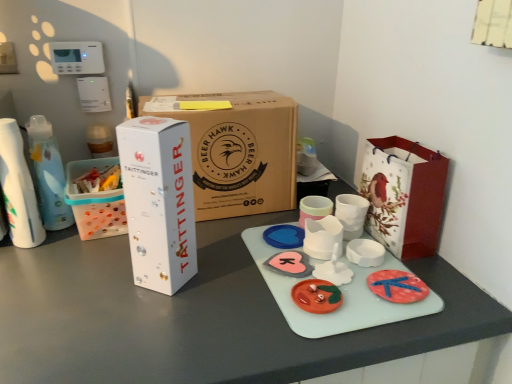
At what (x,y) coordinates should I click in order to perform the action: click on free space to the back side of white glossy box at left, which ranks as the second box in back-to-front order. Please return your answer as a coordinate pair (x, y). This screenshot has width=512, height=384. Looking at the image, I should click on (220, 236).